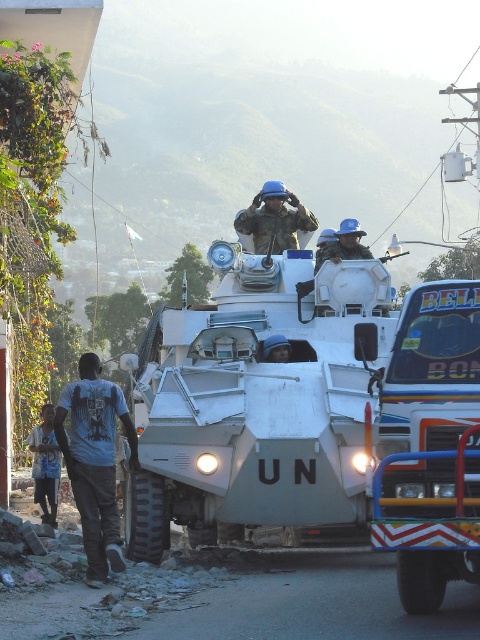
Question: Does metallic painted truck at right have a smaller size compared to matte blue helmet at center?

Choices:
 (A) no
 (B) yes

Answer: (A)

Question: Is dark blue t-shirt at left closer to camera compared to blue matte helmet at center?

Choices:
 (A) yes
 (B) no

Answer: (A)

Question: Which object is positioned closest to the blue matte helmet at center?

Choices:
 (A) metallic painted truck at right
 (B) white matte/unmarked tank at center
 (C) brushed metal shirt at lower left

Answer: (B)

Question: Considering the relative positions of white matte/unmarked tank at center and matte blue helmet at center in the image provided, where is white matte/unmarked tank at center located with respect to matte blue helmet at center?

Choices:
 (A) left
 (B) right

Answer: (A)

Question: Considering the real-world distances, which object is farthest from the brushed metal shirt at lower left?

Choices:
 (A) dark blue t-shirt at left
 (B) white matte/unmarked tank at center

Answer: (A)

Question: Which point is farther from the camera taking this photo?

Choices:
 (A) pyautogui.click(x=359, y=323)
 (B) pyautogui.click(x=288, y=360)
 (C) pyautogui.click(x=36, y=488)
 (D) pyautogui.click(x=98, y=524)

Answer: (C)